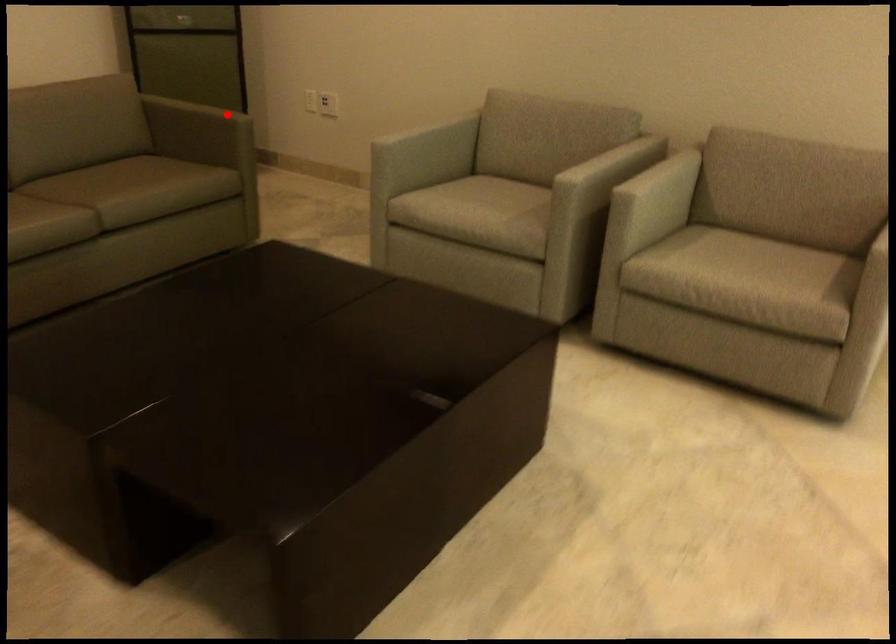
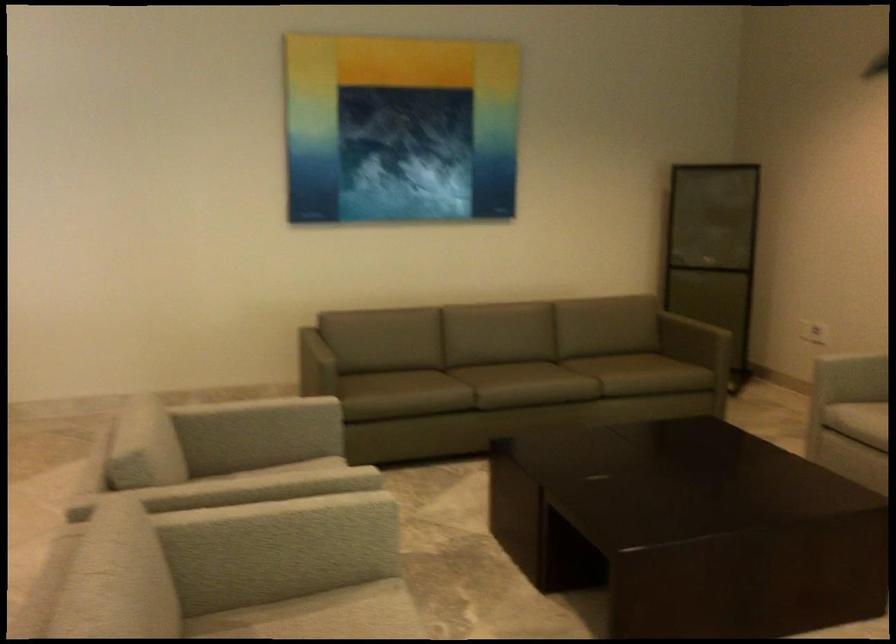
Where in the second image is the point corresponding to the highlighted location from the first image?

(716, 333)